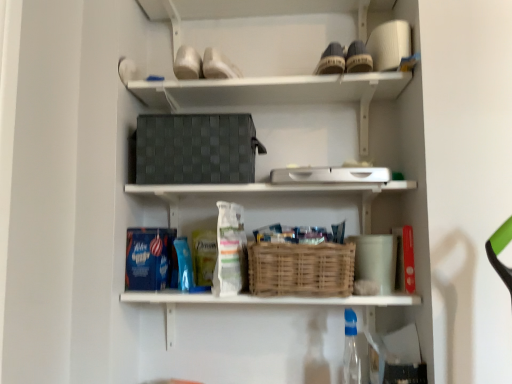
Question: From their relative heights in the image, would you say bamboo basket at center is taller or shorter than transparent plastic bottle at lower center?

Choices:
 (A) short
 (B) tall

Answer: (A)

Question: In terms of width, does bamboo basket at center look wider or thinner when compared to transparent plastic bottle at lower center?

Choices:
 (A) thin
 (B) wide

Answer: (B)

Question: Which is farther from the transparent plastic bottle at lower center?

Choices:
 (A) bamboo basket at center
 (B) dark gray woven basket at upper center, which is the second shelf from bottom to top
 (C) matte brown shoe at upper center
 (D) woven wicker basket at center, which is the second shelf in top-to-bottom order

Answer: (C)

Question: Which object is positioned farthest from the matte brown shoe at upper center?

Choices:
 (A) bamboo basket at center
 (B) woven wicker basket at center, which is the second shelf in top-to-bottom order
 (C) dark gray woven basket at upper center, the first shelf viewed from the top
 (D) transparent plastic bottle at lower center

Answer: (D)